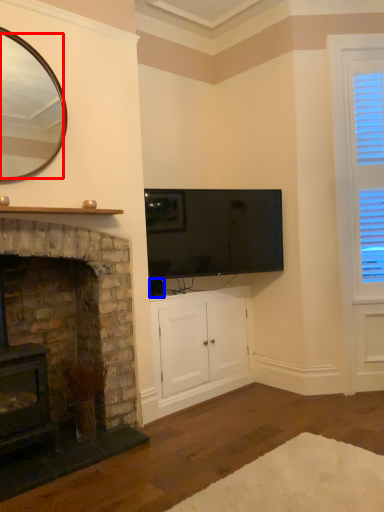
Question: Which point is closer to the camera, mirror (highlighted by a red box) or corded phone (highlighted by a blue box)?

Choices:
 (A) mirror
 (B) corded phone

Answer: (A)